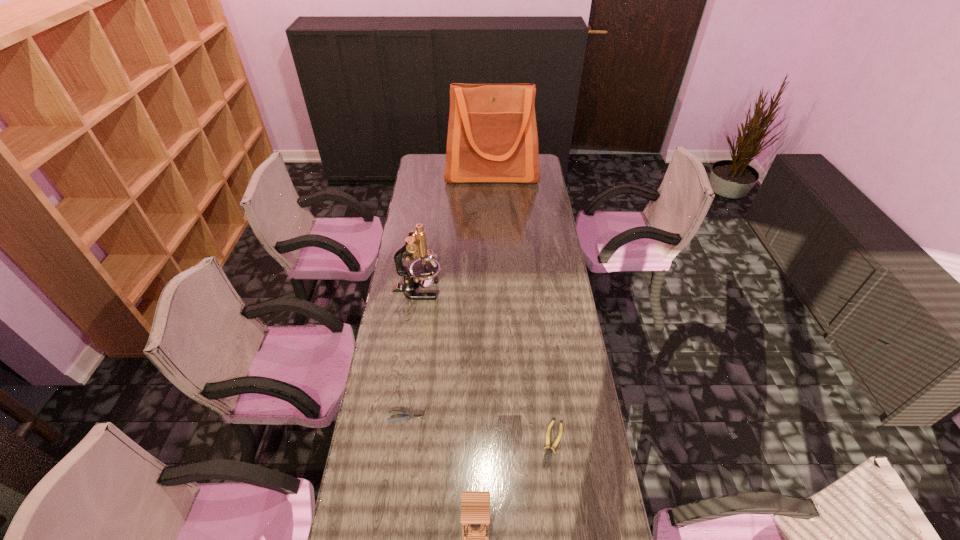
This screenshot has height=540, width=960. In order to click on vacant area between the right pliers and the second tallest object in this screenshot , I will do `click(485, 367)`.

Identify the location of empty location between the shorter pliers and the left pliers. Image resolution: width=960 pixels, height=540 pixels. (479, 430).

Locate an element on the screen. free space between the right pliers and the farthest object is located at coordinates [522, 308].

You are a GUI agent. You are given a task and a screenshot of the screen. Output one action in this format:
    pyautogui.click(x=<x>, y=<y>)
    Task: Click on the vacant space in between the second tallest object and the farthest object
    The width and height of the screenshot is (960, 540).
    Given the screenshot: What is the action you would take?
    pyautogui.click(x=455, y=231)

At what (x,y) coordinates should I click in order to perform the action: click on object that ranks as the fourth closest to the fourth nearest object. Please return your answer as a coordinate pair (x, y). The height and width of the screenshot is (540, 960). Looking at the image, I should click on (475, 505).

Locate which object ranks in proximity to the right pliers. Please provide its 2D coordinates. Your answer should be formatted as a tuple, i.e. [(x, y)], where the tuple contains the x and y coordinates of a point satisfying the conditions above.

[(475, 505)]

Find the location of a particular element. The image size is (960, 540). vacant space that satisfies the following two spatial constraints: 1. at the gripping part of the shorter pliers; 2. on the left side of the left pliers is located at coordinates (402, 444).

Where is `free space that satisfies the following two spatial constraints: 1. at the gripping part of the left pliers; 2. on the left side of the shorter pliers`? The width and height of the screenshot is (960, 540). free space that satisfies the following two spatial constraints: 1. at the gripping part of the left pliers; 2. on the left side of the shorter pliers is located at coordinates (402, 444).

The image size is (960, 540). Identify the location of free space that satisfies the following two spatial constraints: 1. on the front pocket of the tallest object; 2. at the eyepiece of the fourth shortest object. (495, 290).

At what (x,y) coordinates should I click in order to perform the action: click on vacant space that satisfies the following two spatial constraints: 1. on the front pocket of the tallest object; 2. at the eyepiece of the second farthest object. Please return your answer as a coordinate pair (x, y). This screenshot has height=540, width=960. Looking at the image, I should click on (495, 290).